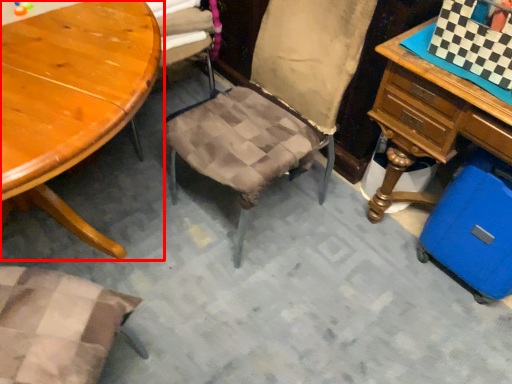
Question: From the image's perspective, where is table (annotated by the red box) located relative to luggage?

Choices:
 (A) below
 (B) above

Answer: (A)